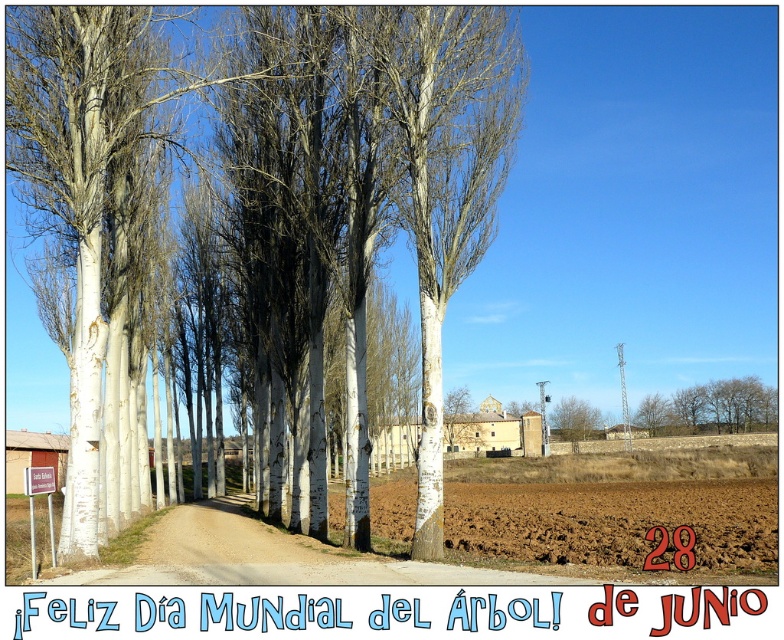
Between point (466, 214) and point (165, 80), which one is positioned in front?

Point (466, 214)

In the scene shown: Can you confirm if white smooth birch tree at center is thinner than white smooth trees at left?

Indeed, white smooth birch tree at center has a lesser width compared to white smooth trees at left.

Is point (452, 237) farther from camera compared to point (49, 138)?

Yes, point (452, 237) is behind point (49, 138).

Identify the location of white smooth birch tree at center. (445, 176).